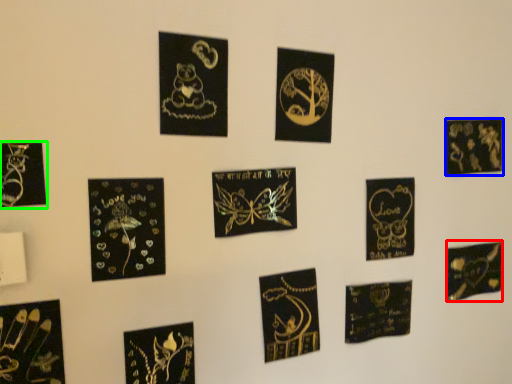
Question: Estimate the real-world distances between objects in this image. Which object is closer to postcard (highlighted by a red box), picture frame (highlighted by a blue box) or picture frame (highlighted by a green box)?

Choices:
 (A) picture frame
 (B) picture frame

Answer: (A)